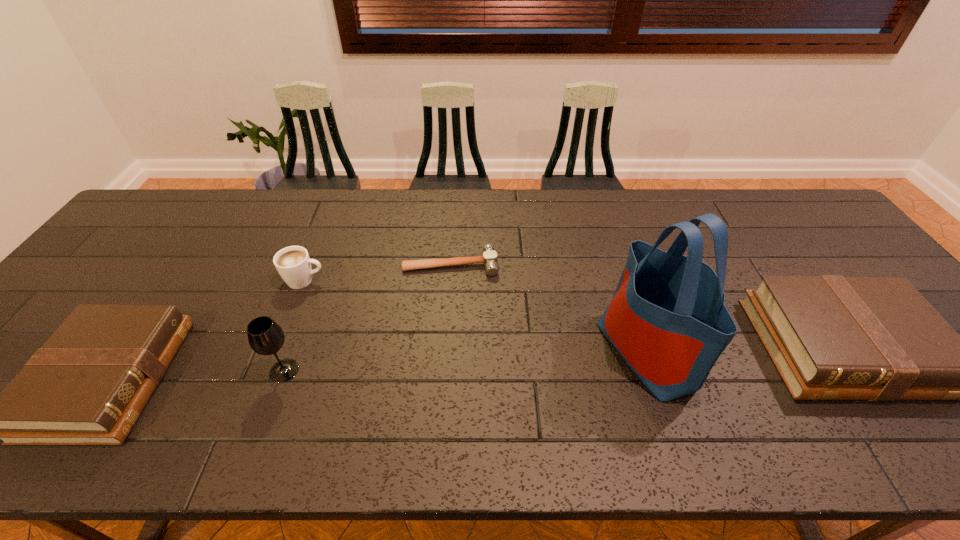
Find the location of a particular element. The width and height of the screenshot is (960, 540). vacant region located 0.280m on the back of the hammer is located at coordinates (455, 195).

Identify the location of vacant space located 0.160m on the left of the wineglass. (200, 370).

The height and width of the screenshot is (540, 960). I want to click on vacant space located on the back of the handbag, so click(622, 276).

This screenshot has width=960, height=540. What are the coordinates of `Bible that is positioned at the near edge` in the screenshot? It's located at pyautogui.click(x=88, y=384).

Where is `wineglass at the near edge`? wineglass at the near edge is located at coordinates (265, 336).

Where is `handbag that is at the near edge`? handbag that is at the near edge is located at coordinates (667, 319).

You are a GUI agent. You are given a task and a screenshot of the screen. Output one action in this format:
    pyautogui.click(x=<x>, y=<y>)
    Task: Click on the object at the left edge
    
    Given the screenshot: What is the action you would take?
    pyautogui.click(x=88, y=384)

Locate an element on the screen. The width and height of the screenshot is (960, 540). object positioned at the near left corner is located at coordinates (88, 384).

At what (x,y) coordinates should I click in order to perform the action: click on free space at the far edge. Please return your answer as a coordinate pair (x, y). The height and width of the screenshot is (540, 960). Looking at the image, I should click on (607, 198).

Where is `free space at the near edge of the desktop`? free space at the near edge of the desktop is located at coordinates (269, 402).